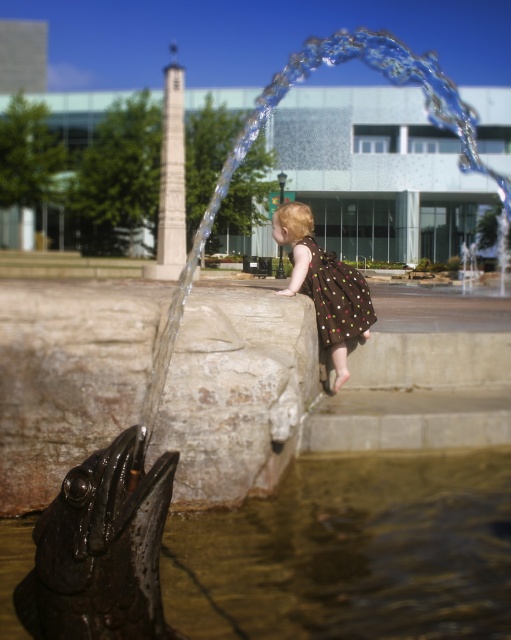
Who is positioned more to the right, brown dotted dress at center or brown dotted fabric dress at upper center?

brown dotted fabric dress at upper center is more to the right.

Does brown dotted dress at center have a greater height compared to brown dotted fabric dress at upper center?

Yes, brown dotted dress at center is taller than brown dotted fabric dress at upper center.

Is point (296, 244) positioned in front of point (360, 291)?

No, it is not.

I want to click on brown dotted dress at center, so click(323, 285).

Who is shorter, shiny metallic fish at lower left or brown dotted fabric dress at upper center?

Standing shorter between the two is shiny metallic fish at lower left.

Identify the location of shiny metallic fish at lower left. The width and height of the screenshot is (511, 640). (351, 552).

The image size is (511, 640). Find the location of `shiny metallic fish at lower left`. shiny metallic fish at lower left is located at coordinates (351, 552).

Identify the location of shiny metallic fish at lower left. (351, 552).

Can you confirm if shiny metallic fish at lower left is positioned to the right of brown dotted dress at center?

Yes, shiny metallic fish at lower left is to the right of brown dotted dress at center.

Identify the location of shiny metallic fish at lower left. The width and height of the screenshot is (511, 640). (351, 552).

Where is `shiny metallic fish at lower left`? This screenshot has width=511, height=640. shiny metallic fish at lower left is located at coordinates pos(351,552).